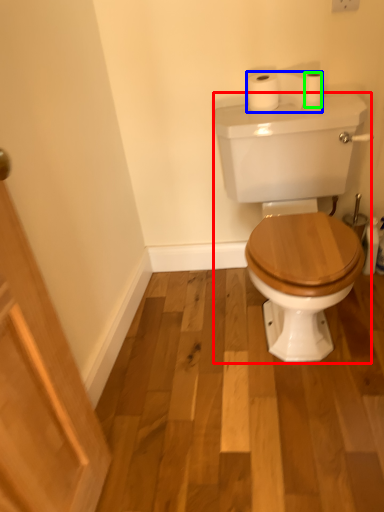
Question: Considering the real-world distances, which object is closest to porcelain (highlighted by a red box)? toilet paper (highlighted by a blue box) or toilet paper (highlighted by a green box).

Choices:
 (A) toilet paper
 (B) toilet paper

Answer: (A)